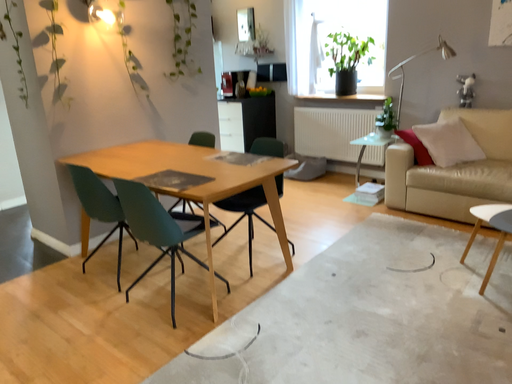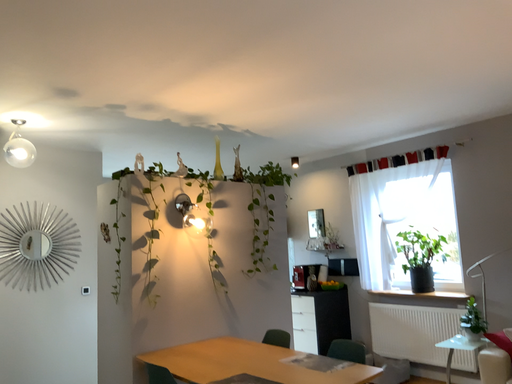
Question: How did the camera likely rotate when shooting the video?

Choices:
 (A) rotated right
 (B) rotated left

Answer: (B)